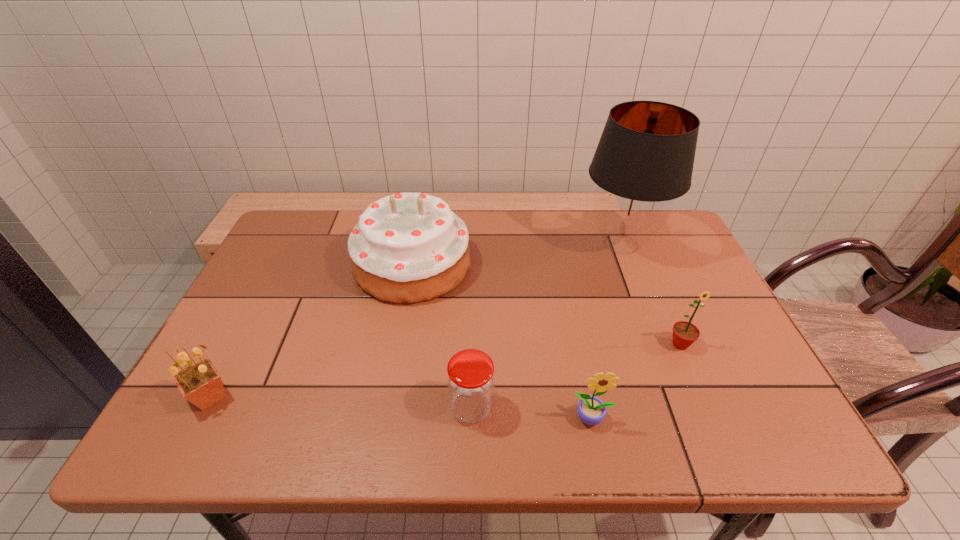
The width and height of the screenshot is (960, 540). In order to click on free space at the far edge in this screenshot , I will do `click(576, 243)`.

The image size is (960, 540). I want to click on vacant space at the left edge of the desktop, so click(x=289, y=301).

Locate an element on the screen. vacant area at the right edge of the desktop is located at coordinates (696, 260).

At what (x,y) coordinates should I click in order to perform the action: click on vacant area at the far left corner. Please return your answer as a coordinate pair (x, y). Looking at the image, I should click on (320, 212).

I want to click on free region at the far right corner, so click(666, 254).

Find the location of a particular element. The width and height of the screenshot is (960, 540). vacant space in between the shortest object and the leftmost sunflower is located at coordinates (341, 402).

At what (x,y) coordinates should I click in order to perform the action: click on vacant space that's between the third farthest object and the fifth shortest object. Please return your answer as a coordinate pair (x, y). The image size is (960, 540). Looking at the image, I should click on (546, 305).

Image resolution: width=960 pixels, height=540 pixels. I want to click on vacant space that is in between the tallest object and the leftmost sunflower, so 416,320.

Where is `free point between the leftmost sunflower and the second sunflower from right to left`? Image resolution: width=960 pixels, height=540 pixels. free point between the leftmost sunflower and the second sunflower from right to left is located at coordinates (401, 407).

You are a GUI agent. You are given a task and a screenshot of the screen. Output one action in this format:
    pyautogui.click(x=<x>, y=<y>)
    Task: Click on the empty space that is in between the fifth shortest object and the jar
    Image resolution: width=960 pixels, height=540 pixels.
    Given the screenshot: What is the action you would take?
    pyautogui.click(x=442, y=336)